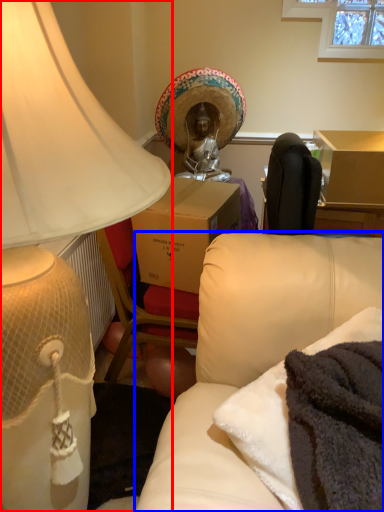
Question: Which point is further to the camera, lamp (highlighted by a red box) or studio couch (highlighted by a blue box)?

Choices:
 (A) lamp
 (B) studio couch

Answer: (B)